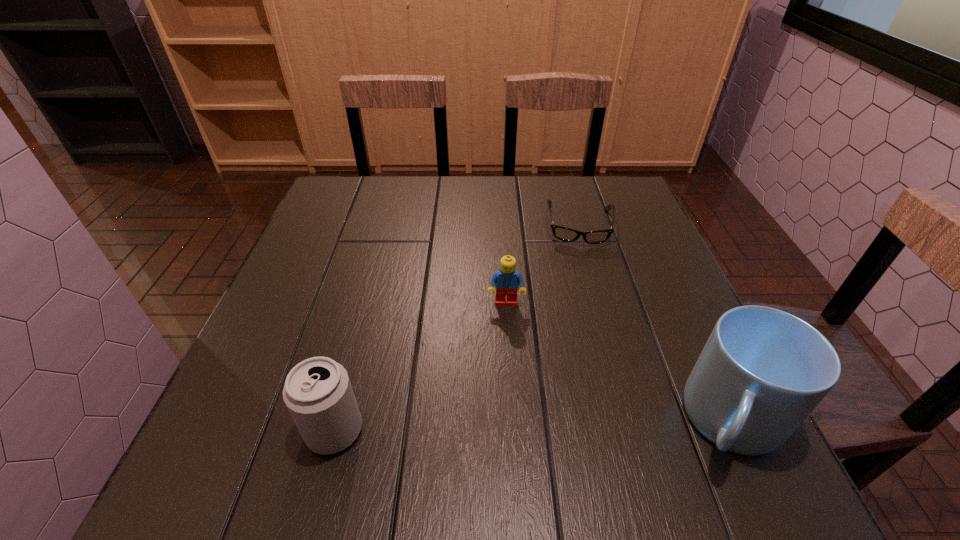
This screenshot has height=540, width=960. What are the coordinates of `vacant space located on the face of the Lego` in the screenshot? It's located at (507, 350).

At what (x,y) coordinates should I click in order to perform the action: click on free spot located 0.240m on the face of the Lego. Please return your answer as a coordinate pair (x, y). Looking at the image, I should click on point(509,410).

You are a GUI agent. You are given a task and a screenshot of the screen. Output one action in this format:
    pyautogui.click(x=<x>, y=<y>)
    Task: Click on the vacant area situated on the front-facing side of the farthest object
    The height and width of the screenshot is (540, 960).
    Given the screenshot: What is the action you would take?
    pyautogui.click(x=585, y=345)

This screenshot has width=960, height=540. What are the coordinates of `free region located on the front-facing side of the farthest object` in the screenshot? It's located at (583, 292).

At what (x,y) coordinates should I click in order to perform the action: click on vacant space positioned on the front-facing side of the farthest object. Please return your answer as a coordinate pair (x, y). Looking at the image, I should click on tap(583, 292).

Locate an element on the screen. This screenshot has width=960, height=540. object that is at the far edge is located at coordinates (562, 233).

Find the location of `can situated at the near edge`. can situated at the near edge is located at coordinates (318, 394).

This screenshot has width=960, height=540. I want to click on mug located at the near edge, so click(x=762, y=371).

Find the location of a particular element. object that is positioned at the left edge is located at coordinates (318, 394).

Where is `mug that is at the right edge`? mug that is at the right edge is located at coordinates (762, 371).